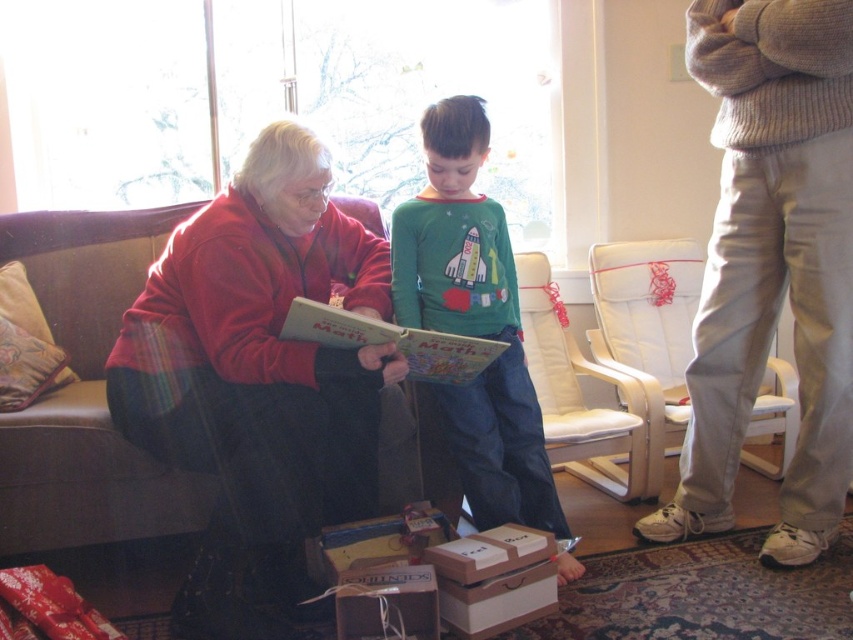
Question: Estimate the real-world distances between objects in this image. Which object is farther from the white leather armchair at right?

Choices:
 (A) white leather armchair at center
 (B) velvet red sweater at left
 (C) brown cardboard box at lower center

Answer: (C)

Question: Is white leather armchair at right closer to the viewer compared to wooden box at lower center?

Choices:
 (A) yes
 (B) no

Answer: (B)

Question: Considering the relative positions of white leather armchair at center and wooden box at lower center in the image provided, where is white leather armchair at center located with respect to wooden box at lower center?

Choices:
 (A) below
 (B) above

Answer: (B)

Question: Based on their relative distances, which object is nearer to the matte paper book at center?

Choices:
 (A) velvet red sweater at left
 (B) white leather armchair at center

Answer: (A)

Question: Is white leather armchair at right below white leather armchair at center?

Choices:
 (A) yes
 (B) no

Answer: (B)

Question: Estimate the real-world distances between objects in this image. Which object is closer to the green cotton shirt at center?

Choices:
 (A) white leather armchair at right
 (B) white leather armchair at center
 (C) velvet red sweater at left

Answer: (C)